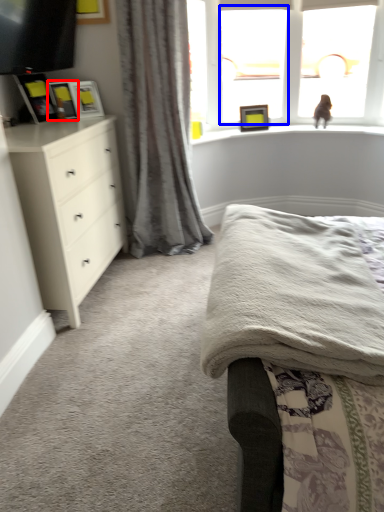
Question: Which of the following is the farthest to the observer, picture frame (highlighted by a red box) or window screen (highlighted by a blue box)?

Choices:
 (A) picture frame
 (B) window screen

Answer: (B)